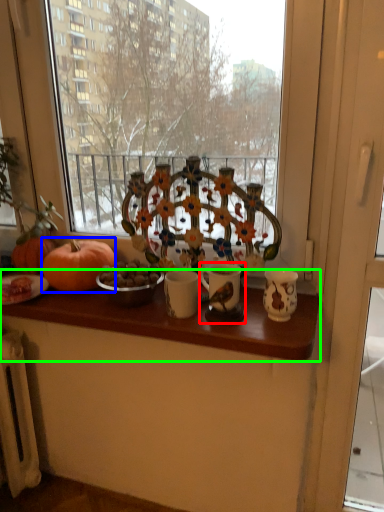
Question: Which is farther away from candle holder (highlighted by a red box)? pumpkin (highlighted by a blue box) or table (highlighted by a green box)?

Choices:
 (A) pumpkin
 (B) table

Answer: (A)